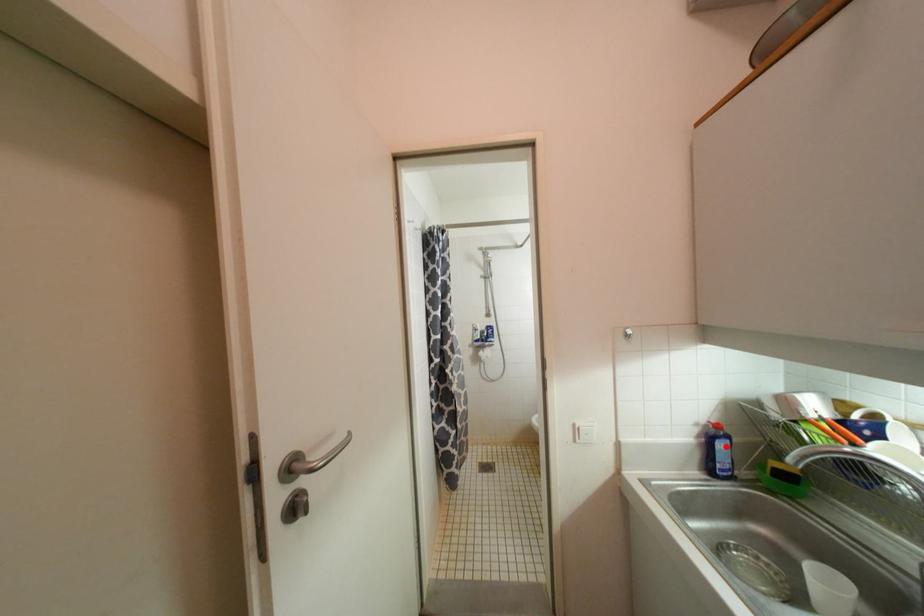
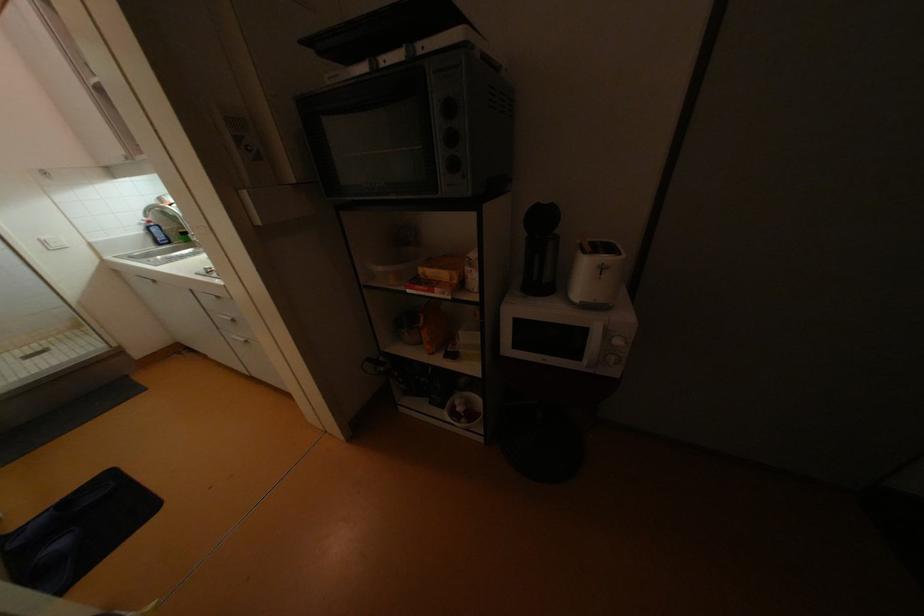
Locate, in the second image, the point that corresponds to the highlighted location in the first image.

(160, 231)